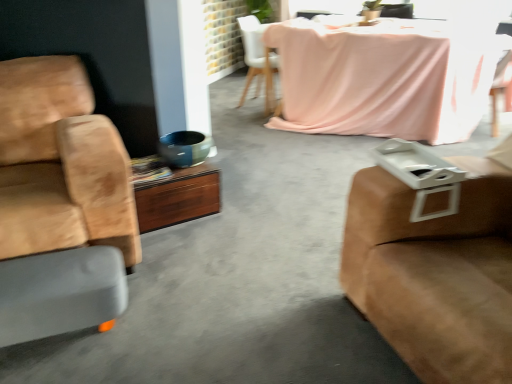
Locate an element on the screen. The height and width of the screenshot is (384, 512). free space to the right of suede tan chair at left, the third chair when ordered from back to front is located at coordinates (212, 261).